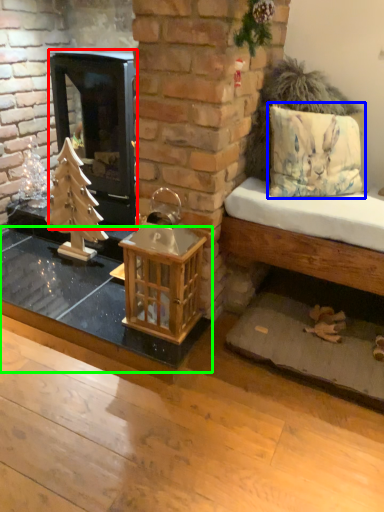
Question: Based on their relative distances, which object is nearer to wood burning stove (highlighted by a red box)? Choose from pillow (highlighted by a blue box) and table (highlighted by a green box).

Choices:
 (A) pillow
 (B) table

Answer: (B)